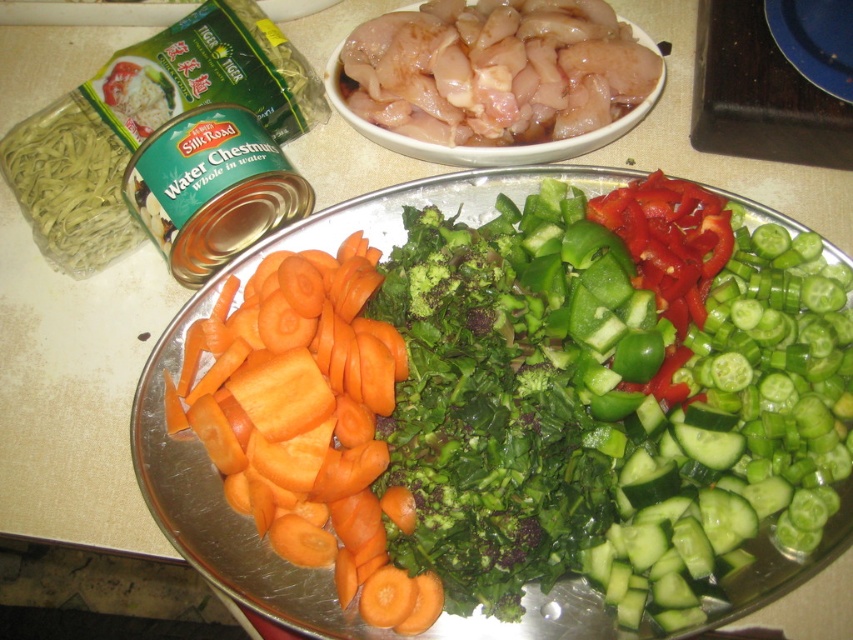
You are a chef preparing a vegetable platter and need to know which ingredient is bigger. Looking at the green smooth cucumber at center and the green leafy broccoli at center, which one has a bigger size?

The green smooth cucumber at center is larger in size than the green leafy broccoli at center.